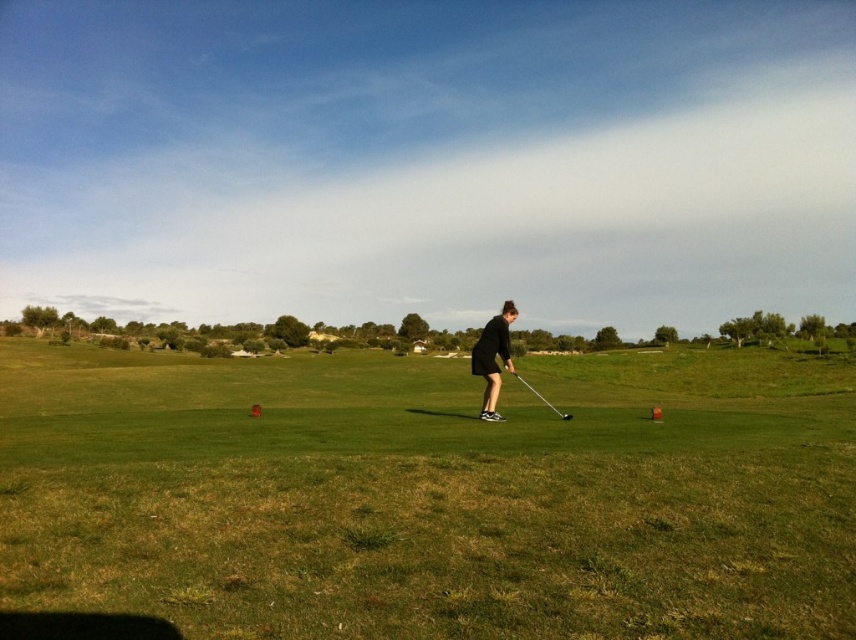
Question: Among these points, which one is farthest from the camera?

Choices:
 (A) (486, 408)
 (B) (562, 412)
 (C) (407, 612)

Answer: (B)

Question: Is green grass at center wider than black matte golf club at center?

Choices:
 (A) yes
 (B) no

Answer: (A)

Question: Can you confirm if green grass at center is positioned above black matte golf club at center?

Choices:
 (A) no
 (B) yes

Answer: (A)

Question: Which point is farther to the camera?

Choices:
 (A) black matte golf club at center
 (B) metallic silver golf club at center
 (C) green grass at center

Answer: (A)

Question: Which object appears farthest from the camera in this image?

Choices:
 (A) metallic silver golf club at center
 (B) black matte golf club at center
 (C) green grass at center

Answer: (B)

Question: Can you confirm if green grass at center is wider than metallic silver golf club at center?

Choices:
 (A) yes
 (B) no

Answer: (A)